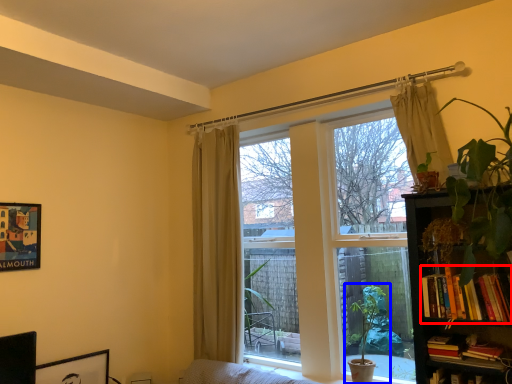
Question: Which point is closer to the camera, book (highlighted by a red box) or houseplant (highlighted by a blue box)?

Choices:
 (A) book
 (B) houseplant

Answer: (A)